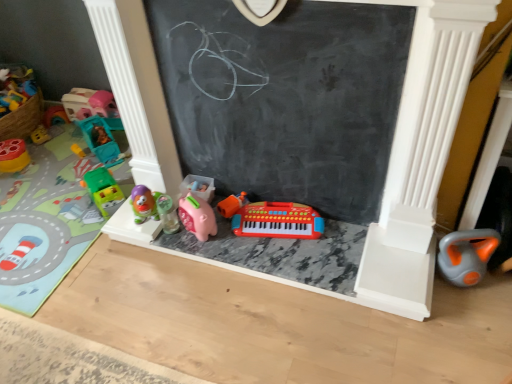
Locate an element on the screen. Image resolution: width=512 pixels, height=384 pixels. vacant space in front of matte yellow and red toy at left, the 1th toy from the left is located at coordinates (17, 180).